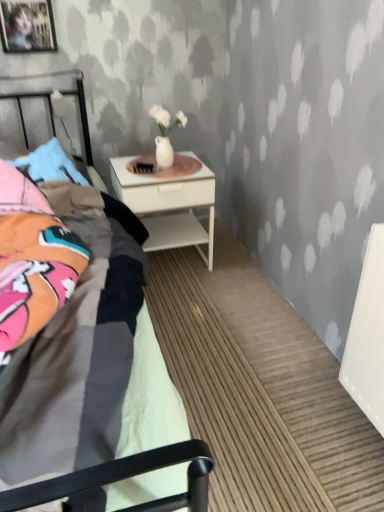
Question: Is white glossy nightstand at center outside wooden picture frame at upper left?

Choices:
 (A) yes
 (B) no

Answer: (A)

Question: Is white glossy nightstand at center looking in the opposite direction of wooden picture frame at upper left?

Choices:
 (A) no
 (B) yes

Answer: (A)

Question: Is white glossy nightstand at center touching wooden picture frame at upper left?

Choices:
 (A) yes
 (B) no

Answer: (B)

Question: Does white glossy nightstand at center have a lesser height compared to wooden picture frame at upper left?

Choices:
 (A) no
 (B) yes

Answer: (A)

Question: Can you confirm if white glossy nightstand at center is thinner than wooden picture frame at upper left?

Choices:
 (A) no
 (B) yes

Answer: (A)

Question: In terms of height, does white textured wall at upper center look taller or shorter compared to wooden picture frame at upper left?

Choices:
 (A) short
 (B) tall

Answer: (B)

Question: From the image's perspective, is white textured wall at upper center positioned above or below wooden picture frame at upper left?

Choices:
 (A) below
 (B) above

Answer: (A)

Question: From a real-world perspective, relative to wooden picture frame at upper left, is white textured wall at upper center vertically above or below?

Choices:
 (A) above
 (B) below

Answer: (B)

Question: In terms of width, does white textured wall at upper center look wider or thinner when compared to wooden picture frame at upper left?

Choices:
 (A) thin
 (B) wide

Answer: (B)

Question: Which is correct: white glossy nightstand at center is inside white textured wall at upper center, or outside of it?

Choices:
 (A) outside
 (B) inside

Answer: (A)

Question: In the image, is white glossy nightstand at center positioned in front of or behind white textured wall at upper center?

Choices:
 (A) front
 (B) behind

Answer: (B)

Question: Is point (155, 233) closer or farther from the camera than point (354, 139)?

Choices:
 (A) farther
 (B) closer

Answer: (A)

Question: From a real-world perspective, relative to white textured wall at upper center, is white glossy nightstand at center vertically above or below?

Choices:
 (A) below
 (B) above

Answer: (A)

Question: From a real-world perspective, is white textured wall at upper center above or below white glossy nightstand at center?

Choices:
 (A) below
 (B) above

Answer: (B)

Question: Considering their positions, is white textured wall at upper center located in front of or behind white glossy nightstand at center?

Choices:
 (A) front
 (B) behind

Answer: (A)